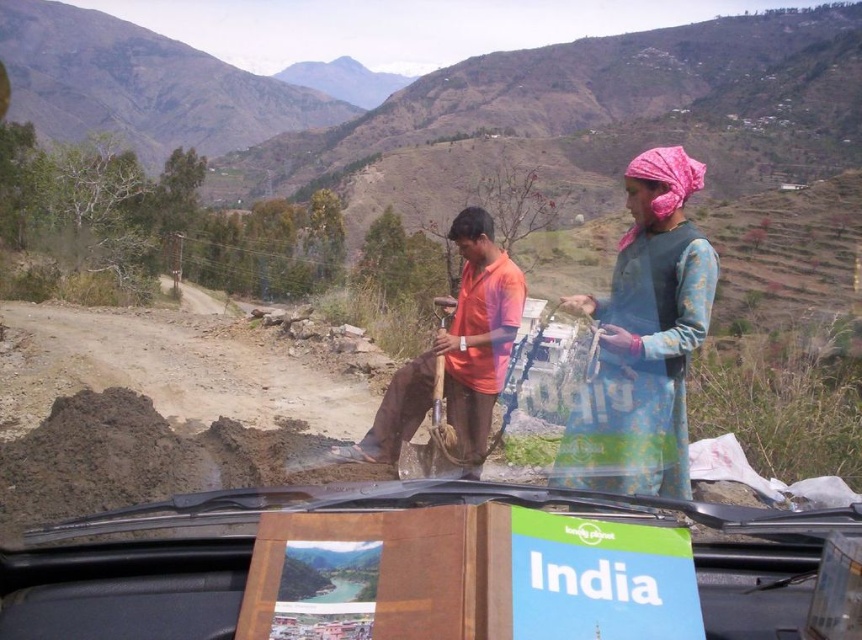
Can you confirm if brown clay at lower left is positioned below pink fabric headscarf at upper right?

Yes.

The image size is (862, 640). What are the coordinates of `brown clay at lower left` in the screenshot? It's located at (139, 458).

In the scene shown: Who is more forward, (466, 269) or (686, 176)?

Point (686, 176) is more forward.

Who is positioned more to the left, orange cotton shirt at center or pink fabric headscarf at upper right?

Positioned to the left is orange cotton shirt at center.

Does point (473, 209) come behind point (654, 179)?

That is True.

Find the location of a particular element. This screenshot has width=862, height=640. orange cotton shirt at center is located at coordinates (x=456, y=355).

Is blue printed dress at right bigger than orange cotton shirt at center?

No.

Is blue printed dress at right smaller than orange cotton shirt at center?

Indeed, blue printed dress at right has a smaller size compared to orange cotton shirt at center.

The width and height of the screenshot is (862, 640). What do you see at coordinates (644, 339) in the screenshot? I see `blue printed dress at right` at bounding box center [644, 339].

The height and width of the screenshot is (640, 862). Find the location of `blue printed dress at right`. blue printed dress at right is located at coordinates (644, 339).